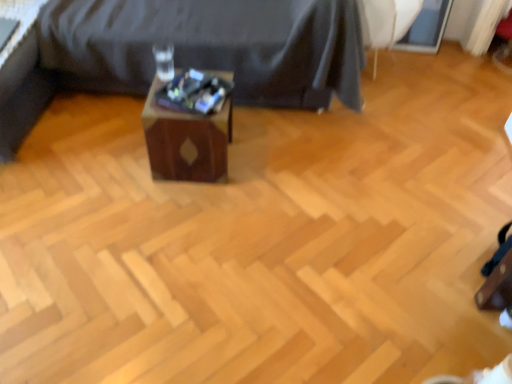
Question: Is white fabric swivel chair at upper right at the right side of wooden side table at center?

Choices:
 (A) no
 (B) yes

Answer: (B)

Question: Considering the relative sizes of white fabric swivel chair at upper right and wooden side table at center in the image provided, is white fabric swivel chair at upper right thinner than wooden side table at center?

Choices:
 (A) yes
 (B) no

Answer: (A)

Question: Is white fabric swivel chair at upper right taller than wooden side table at center?

Choices:
 (A) yes
 (B) no

Answer: (B)

Question: Would you say white fabric swivel chair at upper right is a long distance from wooden side table at center?

Choices:
 (A) no
 (B) yes

Answer: (A)

Question: From the image's perspective, is white fabric swivel chair at upper right on wooden side table at center?

Choices:
 (A) no
 (B) yes

Answer: (A)

Question: Is white fabric swivel chair at upper right wider than wooden side table at center?

Choices:
 (A) no
 (B) yes

Answer: (A)

Question: Can you confirm if wooden side table at center is smaller than white fabric swivel chair at upper right?

Choices:
 (A) no
 (B) yes

Answer: (A)

Question: Is white fabric swivel chair at upper right a part of wooden side table at center?

Choices:
 (A) yes
 (B) no

Answer: (B)

Question: Considering the relative sizes of wooden side table at center and white fabric swivel chair at upper right in the image provided, is wooden side table at center taller than white fabric swivel chair at upper right?

Choices:
 (A) yes
 (B) no

Answer: (A)

Question: Is wooden side table at center aimed at white fabric swivel chair at upper right?

Choices:
 (A) yes
 (B) no

Answer: (B)

Question: Is wooden side table at center positioned in front of white fabric swivel chair at upper right?

Choices:
 (A) yes
 (B) no

Answer: (A)

Question: From a real-world perspective, is wooden side table at center below white fabric swivel chair at upper right?

Choices:
 (A) yes
 (B) no

Answer: (B)

Question: From the image's perspective, is wooden box at center above white fabric swivel chair at upper right?

Choices:
 (A) yes
 (B) no

Answer: (B)